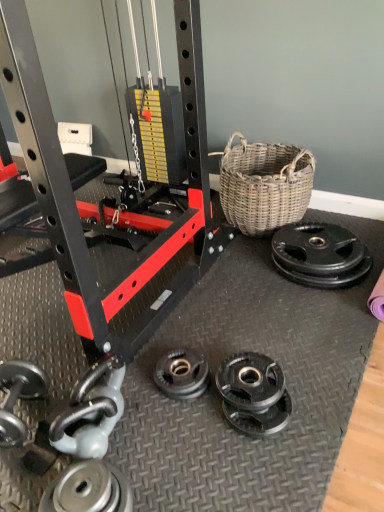
Question: Is silver metallic weight plate at lower left, the first wheel positioned from the left, at the back of black rubber weight plate at right, positioned as the first wheel in back-to-front order?

Choices:
 (A) yes
 (B) no

Answer: (B)

Question: Is black rubber weight plate at right, acting as the 2th wheel starting from the front, positioned beyond the bounds of silver metallic weight plate at lower left, positioned as the second wheel in top-to-bottom order?

Choices:
 (A) no
 (B) yes

Answer: (B)

Question: Can you confirm if black rubber weight plate at right, positioned as the first wheel in back-to-front order, is smaller than silver metallic weight plate at lower left, arranged as the first wheel when viewed from the front?

Choices:
 (A) no
 (B) yes

Answer: (A)

Question: Is black rubber weight plate at right, placed as the 1th wheel when sorted from top to bottom, beside silver metallic weight plate at lower left, positioned as the second wheel in top-to-bottom order?

Choices:
 (A) no
 (B) yes

Answer: (A)

Question: From a real-world perspective, is black rubber weight plate at right, which ranks as the first wheel in right-to-left order, positioned under silver metallic weight plate at lower left, arranged as the first wheel when viewed from the front, based on gravity?

Choices:
 (A) no
 (B) yes

Answer: (A)

Question: From their relative heights in the image, would you say silver metallic dumbbell at lower left is taller or shorter than silver metallic weight plate at lower left, the first wheel positioned from the left?

Choices:
 (A) short
 (B) tall

Answer: (B)

Question: Is point (117, 370) closer or farther from the camera than point (94, 485)?

Choices:
 (A) farther
 (B) closer

Answer: (A)

Question: From the image's perspective, is silver metallic dumbbell at lower left positioned above or below silver metallic weight plate at lower left, the 1th wheel when ordered from bottom to top?

Choices:
 (A) above
 (B) below

Answer: (A)

Question: Is silver metallic dumbbell at lower left wider or thinner than silver metallic weight plate at lower left, arranged as the first wheel when viewed from the front?

Choices:
 (A) thin
 (B) wide

Answer: (A)

Question: From the image's perspective, is silver metallic weight plate at lower left, the first wheel positioned from the left, above or below black rubber weight plate at right, acting as the 2th wheel starting from the front?

Choices:
 (A) above
 (B) below

Answer: (B)

Question: Based on their sizes in the image, would you say silver metallic weight plate at lower left, arranged as the first wheel when viewed from the front, is bigger or smaller than black rubber weight plate at right, placed as the 1th wheel when sorted from top to bottom?

Choices:
 (A) big
 (B) small

Answer: (B)

Question: Relative to black rubber weight plate at right, the second wheel positioned from the bottom, is silver metallic weight plate at lower left, the 1th wheel when ordered from bottom to top, in front or behind?

Choices:
 (A) front
 (B) behind

Answer: (A)

Question: Is point (94, 486) closer or farther from the camera than point (306, 270)?

Choices:
 (A) closer
 (B) farther

Answer: (A)

Question: Is silver metallic weight plate at lower left, the first wheel positioned from the left, in front of or behind silver metallic dumbbell at lower left in the image?

Choices:
 (A) front
 (B) behind

Answer: (A)

Question: Considering the positions of silver metallic weight plate at lower left, which ranks as the second wheel in right-to-left order, and silver metallic dumbbell at lower left in the image, is silver metallic weight plate at lower left, which ranks as the second wheel in right-to-left order, taller or shorter than silver metallic dumbbell at lower left?

Choices:
 (A) tall
 (B) short

Answer: (B)